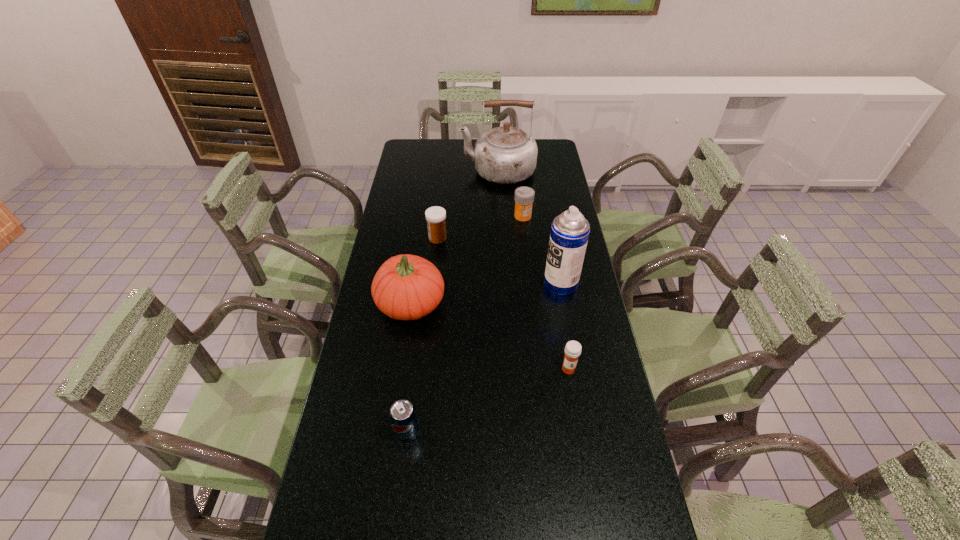
Locate an element on the screen. This screenshot has height=540, width=960. vacant space located 0.200m at the spout of the kettle is located at coordinates (416, 172).

Find the location of `vacant area located 0.130m at the spout of the kettle`. vacant area located 0.130m at the spout of the kettle is located at coordinates (431, 172).

The width and height of the screenshot is (960, 540). I want to click on blank space located 0.250m at the spout of the kettle, so click(404, 172).

Identify the location of blank space located 0.240m on the label side of the aerosol can. Image resolution: width=960 pixels, height=540 pixels. (472, 284).

Identify the location of vacant area situated 0.100m on the label side of the aerosol can. The width and height of the screenshot is (960, 540). (514, 284).

The width and height of the screenshot is (960, 540). I want to click on vacant space located on the label side of the aerosol can, so tap(475, 284).

I want to click on free region located 0.070m on the right of the pumpkin, so click(468, 303).

What are the coordinates of `vacant space located on the front of the leftmost medicine` in the screenshot? It's located at (432, 294).

Locate an element on the screen. This screenshot has height=540, width=960. free spot located 0.120m on the label side of the sixth nearest object is located at coordinates (526, 242).

Find the location of a particular element. This screenshot has height=540, width=960. free space located on the front of the nearest object is located at coordinates (401, 482).